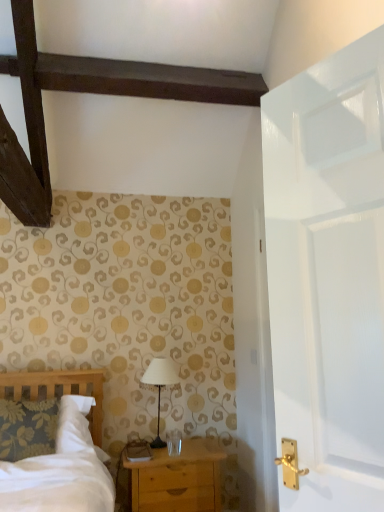
Question: Considering the relative sizes of white fabric lampshade at center and light brown wooden chest of drawers at lower center in the image provided, is white fabric lampshade at center smaller than light brown wooden chest of drawers at lower center?

Choices:
 (A) yes
 (B) no

Answer: (A)

Question: Is white fabric lampshade at center taller than light brown wooden chest of drawers at lower center?

Choices:
 (A) yes
 (B) no

Answer: (A)

Question: Considering the relative positions of white fabric lampshade at center and light brown wooden chest of drawers at lower center in the image provided, is white fabric lampshade at center to the left of light brown wooden chest of drawers at lower center from the viewer's perspective?

Choices:
 (A) no
 (B) yes

Answer: (B)

Question: From the image's perspective, is white fabric lampshade at center below light brown wooden chest of drawers at lower center?

Choices:
 (A) yes
 (B) no

Answer: (B)

Question: Are white fabric lampshade at center and light brown wooden chest of drawers at lower center far apart?

Choices:
 (A) yes
 (B) no

Answer: (B)

Question: Does white fabric lampshade at center touch light brown wooden chest of drawers at lower center?

Choices:
 (A) no
 (B) yes

Answer: (A)

Question: Considering the relative positions of light brown wooden chest of drawers at lower center and white fabric lampshade at center in the image provided, is light brown wooden chest of drawers at lower center to the right of white fabric lampshade at center from the viewer's perspective?

Choices:
 (A) no
 (B) yes

Answer: (B)

Question: Does light brown wooden chest of drawers at lower center have a greater width compared to white fabric lampshade at center?

Choices:
 (A) no
 (B) yes

Answer: (B)

Question: From a real-world perspective, is light brown wooden chest of drawers at lower center positioned under white fabric lampshade at center based on gravity?

Choices:
 (A) yes
 (B) no

Answer: (A)

Question: Is light brown wooden chest of drawers at lower center not near white fabric lampshade at center?

Choices:
 (A) no
 (B) yes

Answer: (A)

Question: Does light brown wooden chest of drawers at lower center come behind white fabric lampshade at center?

Choices:
 (A) no
 (B) yes

Answer: (A)

Question: From a real-world perspective, does light brown wooden chest of drawers at lower center stand above white fabric lampshade at center?

Choices:
 (A) yes
 (B) no

Answer: (B)

Question: Considering the positions of light brown wooden chest of drawers at lower center and white fabric lampshade at center in the image, is light brown wooden chest of drawers at lower center taller or shorter than white fabric lampshade at center?

Choices:
 (A) short
 (B) tall

Answer: (A)